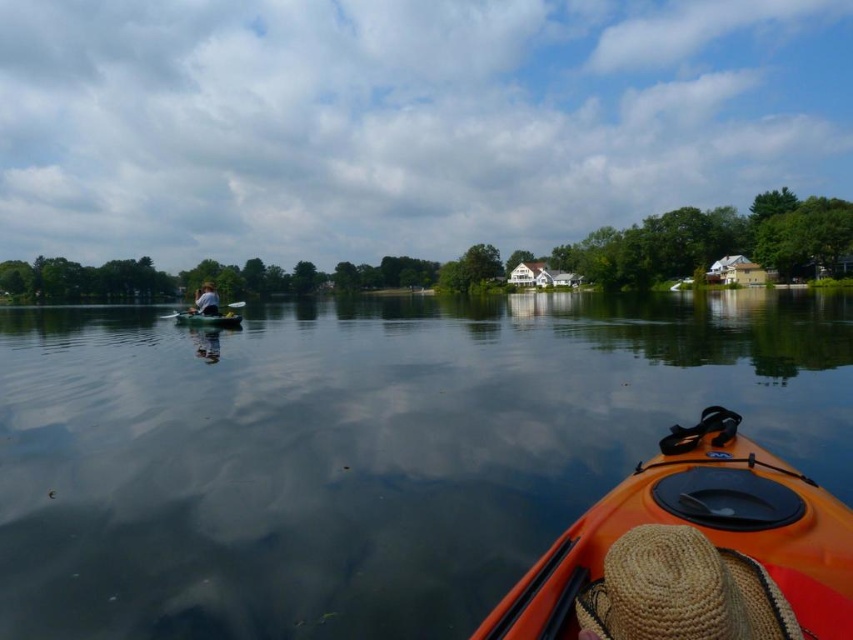
Question: Which object appears closest to the camera in this image?

Choices:
 (A) woven straw hat at lower right
 (B) orange plastic canoe at center
 (C) smooth dark water at center
 (D) white fabric shirt at left

Answer: (A)

Question: Which is nearer to the wooden paddle at left?

Choices:
 (A) orange plastic canoe at center
 (B) smooth dark water at center
 (C) orange matte kayak at lower right
 (D) woven straw hat at lower right

Answer: (A)

Question: Does orange plastic canoe at center appear on the left side of wooden paddle at left?

Choices:
 (A) no
 (B) yes

Answer: (A)

Question: Can you confirm if woven straw hat at lower right is positioned above white fabric shirt at left?

Choices:
 (A) yes
 (B) no

Answer: (B)

Question: Is smooth dark water at center below wooden paddle at left?

Choices:
 (A) yes
 (B) no

Answer: (B)

Question: Which object is farther from the camera taking this photo?

Choices:
 (A) woven straw hat at lower right
 (B) orange matte kayak at lower right
 (C) wooden paddle at left

Answer: (C)